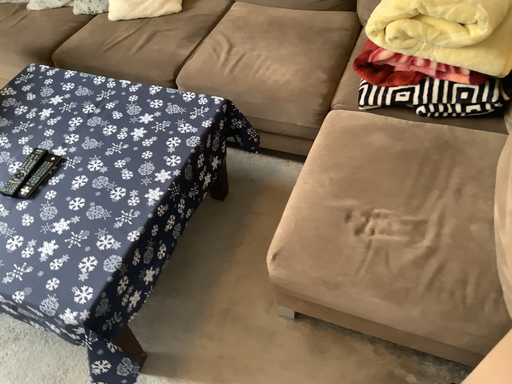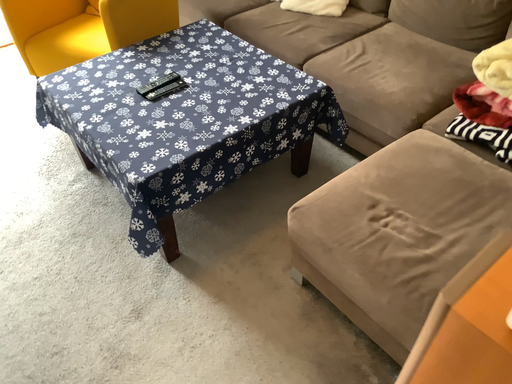
Question: How did the camera likely rotate when shooting the video?

Choices:
 (A) rotated left
 (B) rotated right

Answer: (A)